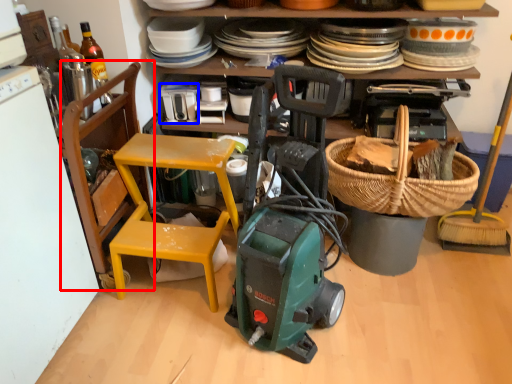
Question: Which point is further to the camera, chair (highlighted by a red box) or appliance (highlighted by a blue box)?

Choices:
 (A) chair
 (B) appliance

Answer: (B)